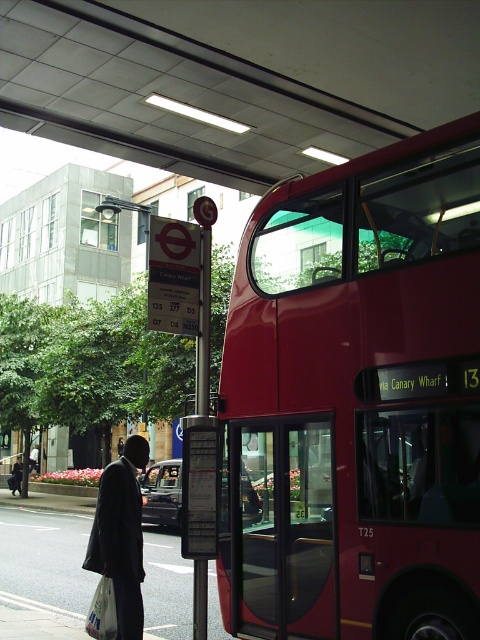
Question: Does dark matte suit at lower left have a lesser width compared to white plastic bag at lower left?

Choices:
 (A) yes
 (B) no

Answer: (A)

Question: In this image, where is dark matte suit at lower left located relative to white plastic bag at lower left?

Choices:
 (A) left
 (B) right

Answer: (B)

Question: Is dark matte suit at lower left thinner than white plastic bag at lower left?

Choices:
 (A) no
 (B) yes

Answer: (B)

Question: Which point is farther from the camera taking this photo?

Choices:
 (A) (141, 536)
 (B) (91, 621)
 (C) (322, 352)

Answer: (C)

Question: Among these points, which one is farthest from the camera?

Choices:
 (A) (105, 616)
 (B) (120, 532)
 (C) (268, 564)

Answer: (C)

Question: Which is farther from the white plastic bag at lower left?

Choices:
 (A) dark matte suit at lower left
 (B) shiny red bus at right

Answer: (B)